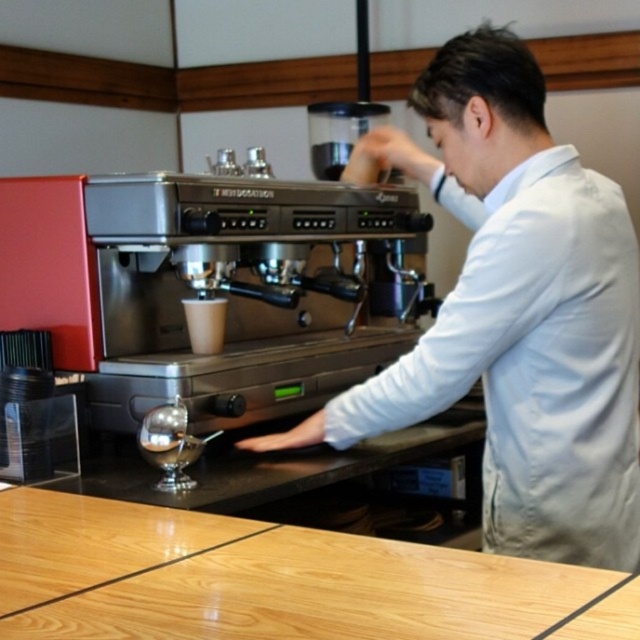
Can you confirm if metallic silver espresso machine at center is shorter than wooden at center?

In fact, metallic silver espresso machine at center may be taller than wooden at center.

I want to click on metallic silver espresso machine at center, so click(211, 288).